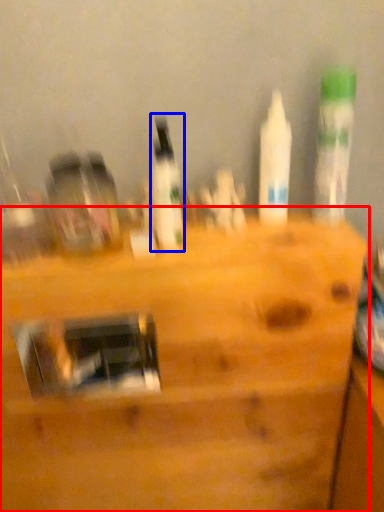
Question: Which point is closer to the camera, furniture (highlighted by a red box) or bottle (highlighted by a blue box)?

Choices:
 (A) furniture
 (B) bottle

Answer: (B)